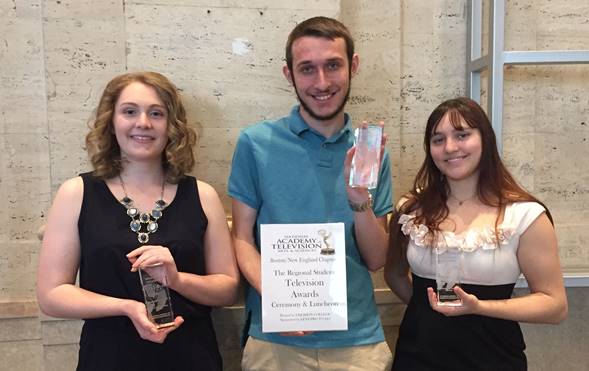
Find the location of `wall border trim`. wall border trim is located at coordinates (18, 313), (387, 296).